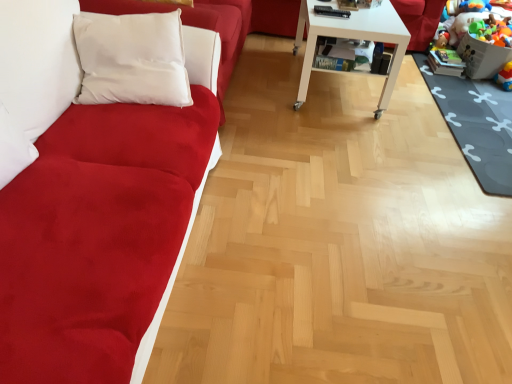
Question: Can you confirm if white glossy table at center is taller than dark gray rubber mat at lower right?

Choices:
 (A) no
 (B) yes

Answer: (B)

Question: From a real-world perspective, is white glossy table at center under dark gray rubber mat at lower right?

Choices:
 (A) no
 (B) yes

Answer: (A)

Question: Can you confirm if white glossy table at center is thinner than dark gray rubber mat at lower right?

Choices:
 (A) yes
 (B) no

Answer: (A)

Question: Can you confirm if white glossy table at center is positioned to the left of dark gray rubber mat at lower right?

Choices:
 (A) yes
 (B) no

Answer: (A)

Question: Would you say dark gray rubber mat at lower right is part of white glossy table at center's contents?

Choices:
 (A) yes
 (B) no

Answer: (B)

Question: Based on their positions, is suede-like red couch at left located to the left or right of white glossy table at center?

Choices:
 (A) left
 (B) right

Answer: (A)

Question: Considering the positions of point (128, 342) and point (384, 99), is point (128, 342) closer or farther from the camera than point (384, 99)?

Choices:
 (A) closer
 (B) farther

Answer: (A)

Question: Is suede-like red couch at left wider or thinner than white glossy table at center?

Choices:
 (A) thin
 (B) wide

Answer: (A)

Question: From the image's perspective, is suede-like red couch at left above or below white glossy table at center?

Choices:
 (A) above
 (B) below

Answer: (B)

Question: From a real-world perspective, is rubberized plastic toy at lower right, which appears as the first toy when ordered from the bottom, positioned above or below plush multicolored toys at lower right, acting as the second toy starting from the bottom?

Choices:
 (A) below
 (B) above

Answer: (A)

Question: Which is correct: rubberized plastic toy at lower right, which appears as the first toy when ordered from the bottom, is inside plush multicolored toys at lower right, acting as the 1th toy starting from the top, or outside of it?

Choices:
 (A) outside
 (B) inside

Answer: (A)

Question: Is point (499, 84) closer or farther from the camera than point (479, 59)?

Choices:
 (A) farther
 (B) closer

Answer: (B)

Question: Is rubberized plastic toy at lower right, which appears as the first toy when ordered from the bottom, wider or thinner than plush multicolored toys at lower right, acting as the 1th toy starting from the top?

Choices:
 (A) thin
 (B) wide

Answer: (A)

Question: From the image's perspective, is white glossy table at center located above or below suede-like red couch at left?

Choices:
 (A) below
 (B) above

Answer: (B)

Question: Which is correct: white glossy table at center is inside suede-like red couch at left, or outside of it?

Choices:
 (A) outside
 (B) inside

Answer: (A)